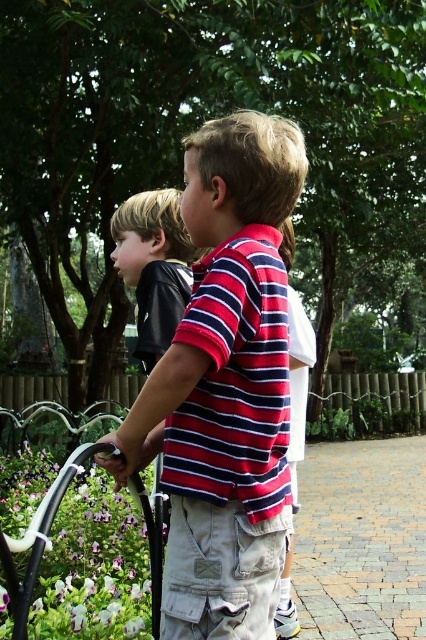
Between striped cotton shirt at center and white plastic rail at lower left, which one is positioned higher?

striped cotton shirt at center

Who is positioned more to the right, striped cotton shirt at center or white plastic rail at lower left?

From the viewer's perspective, striped cotton shirt at center appears more on the right side.

Which is behind, point (184, 634) or point (158, 570)?

The point (158, 570) is more distant.

Identify the location of striped cotton shirt at center. The width and height of the screenshot is (426, 640). pyautogui.click(x=226, y=387).